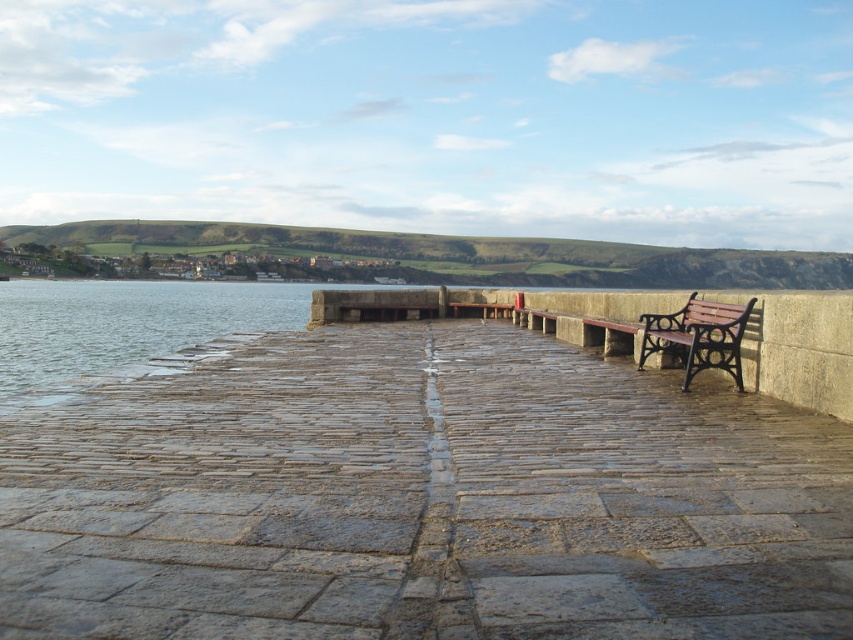
Can you confirm if stone textured dock at center is thinner than brown wooden bench at right?

No, stone textured dock at center is not thinner than brown wooden bench at right.

Does stone textured dock at center appear on the left side of brown wooden bench at right?

Indeed, stone textured dock at center is positioned on the left side of brown wooden bench at right.

Is point (550, 618) behind point (699, 321)?

No, it is in front of (699, 321).

Find the location of `stone textured dock at center`. stone textured dock at center is located at coordinates (419, 497).